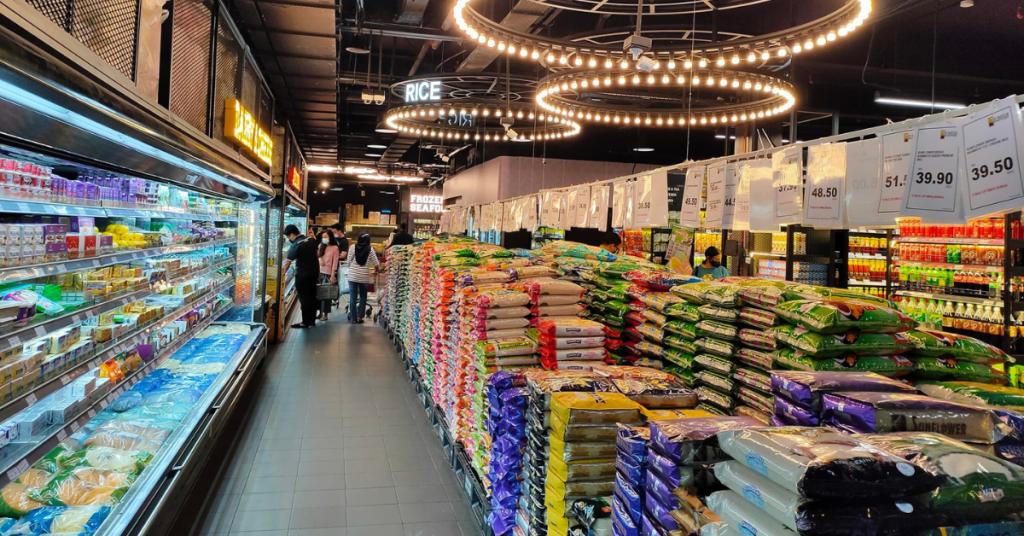
Image resolution: width=1024 pixels, height=536 pixels. Identify the location of light. (651, 64).